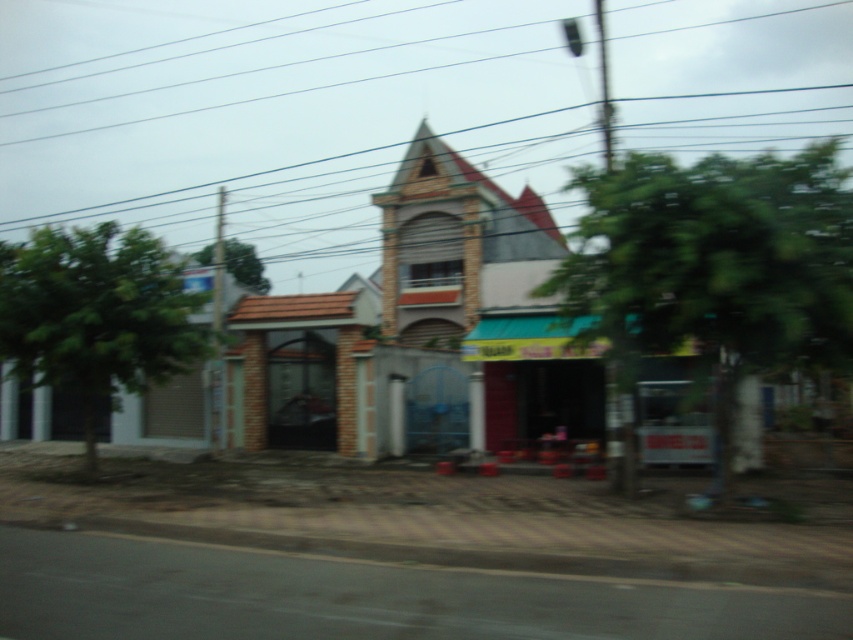
You are a delivery person standing at the entrance of the building. You need to place a package at point [440,109] and another at point [74,243]. Which point should you visit first to ensure you follow the correct spatial order?

You should visit point [74,243] first because point [440,109] is behind it, so visiting the closer point first ensures proper spatial order.

You are a construction worker on the street in front of the building. You need to secure a safety net between the metallic wire at upper center and the green leafy tree at upper center. Which object should you attach the safety net to first to ensure it is properly anchored?

You should attach the safety net to the green leafy tree at upper center first because the metallic wire at upper center is to the right of it, so anchoring the tree first will allow the net to be correctly positioned between them.